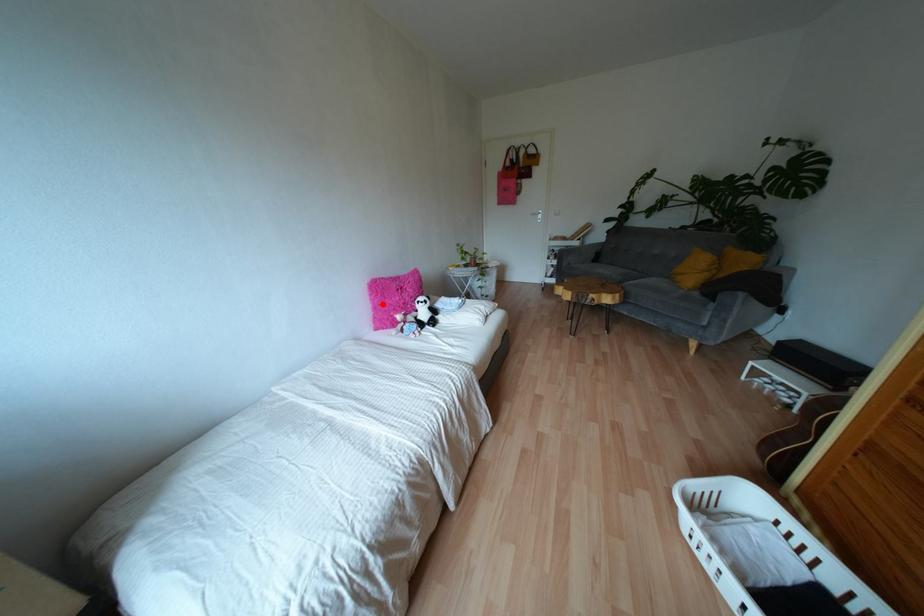
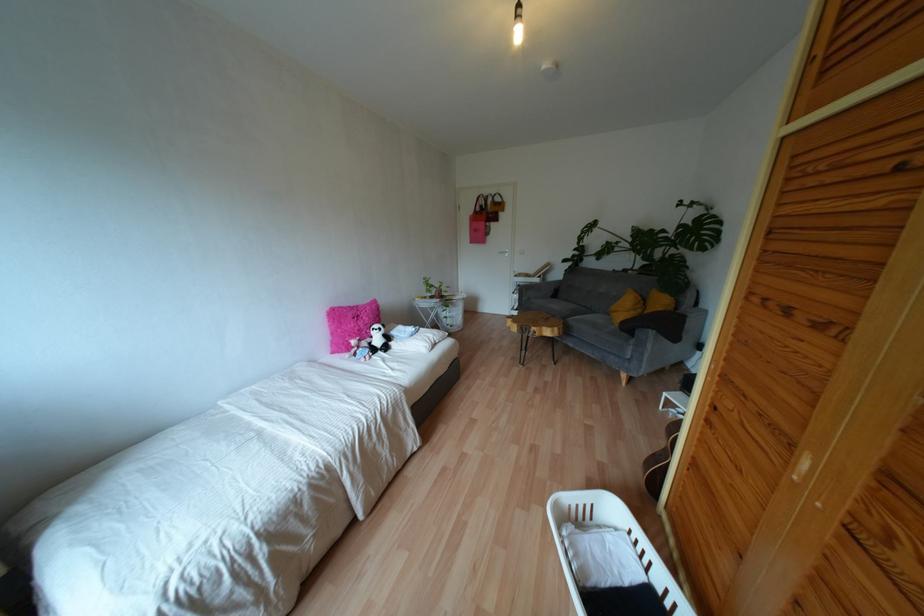
Where in the second image is the point corresponding to the highlighted location from the first image?

(338, 330)